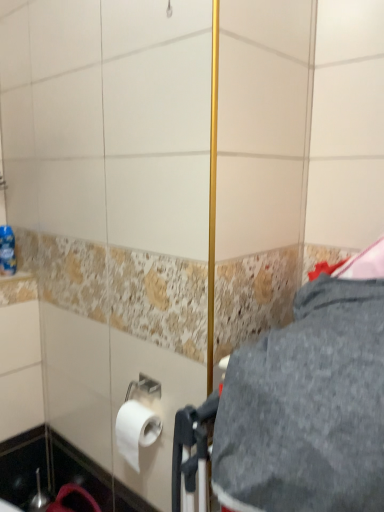
Question: From the image's perspective, is gray fabric at center above white matte toilet paper at lower left?

Choices:
 (A) no
 (B) yes

Answer: (B)

Question: Does gray fabric at center appear on the right side of white matte toilet paper at lower left?

Choices:
 (A) yes
 (B) no

Answer: (A)

Question: Is gray fabric at center smaller than white matte toilet paper at lower left?

Choices:
 (A) no
 (B) yes

Answer: (A)

Question: Considering the relative positions of gray fabric at center and white matte toilet paper at lower left in the image provided, is gray fabric at center to the left of white matte toilet paper at lower left from the viewer's perspective?

Choices:
 (A) no
 (B) yes

Answer: (A)

Question: Considering the relative sizes of gray fabric at center and white matte toilet paper at lower left in the image provided, is gray fabric at center thinner than white matte toilet paper at lower left?

Choices:
 (A) yes
 (B) no

Answer: (B)

Question: Does gray fabric at center come in front of white matte toilet paper at lower left?

Choices:
 (A) yes
 (B) no

Answer: (A)

Question: Is white matte toilet paper at lower left completely or partially outside of gray fabric at center?

Choices:
 (A) yes
 (B) no

Answer: (A)

Question: Is white matte toilet paper at lower left behind gray fabric at center?

Choices:
 (A) yes
 (B) no

Answer: (A)

Question: Considering the relative sizes of white matte toilet paper at lower left and gray fabric at center in the image provided, is white matte toilet paper at lower left shorter than gray fabric at center?

Choices:
 (A) no
 (B) yes

Answer: (B)

Question: Considering the relative sizes of white matte toilet paper at lower left and gray fabric at center in the image provided, is white matte toilet paper at lower left thinner than gray fabric at center?

Choices:
 (A) yes
 (B) no

Answer: (A)

Question: Is white matte toilet paper at lower left smaller than gray fabric at center?

Choices:
 (A) yes
 (B) no

Answer: (A)

Question: From a real-world perspective, is white matte toilet paper at lower left over gray fabric at center?

Choices:
 (A) yes
 (B) no

Answer: (B)

Question: Considering the relative positions of white matte toilet paper at lower left and blue plastic bottle at left in the image provided, is white matte toilet paper at lower left to the right of blue plastic bottle at left from the viewer's perspective?

Choices:
 (A) no
 (B) yes

Answer: (B)